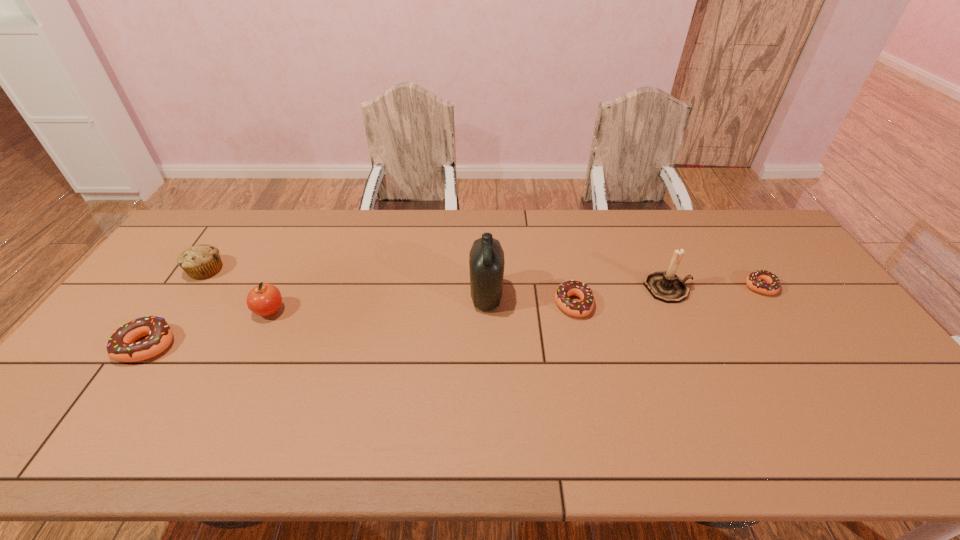
You are a GUI agent. You are given a task and a screenshot of the screen. Output one action in this format:
    pyautogui.click(x=<x>, y=<y>)
    Task: Click on the unoccupied position between the third tallest object and the candle holder
    
    Given the screenshot: What is the action you would take?
    pyautogui.click(x=468, y=300)

The height and width of the screenshot is (540, 960). I want to click on vacant space in between the bottle and the fifth shortest object, so click(x=378, y=304).

You are a GUI agent. You are given a task and a screenshot of the screen. Output one action in this format:
    pyautogui.click(x=<x>, y=<y>)
    Task: Click on the vacant space that is in between the fifth shortest object and the third shortest object
    The width and height of the screenshot is (960, 540).
    Given the screenshot: What is the action you would take?
    pyautogui.click(x=208, y=328)

Image resolution: width=960 pixels, height=540 pixels. Find the location of `unoccupied area between the shortest doughnut and the apple`. unoccupied area between the shortest doughnut and the apple is located at coordinates (516, 299).

Locate an element on the screen. The width and height of the screenshot is (960, 540). empty space that is in between the third object from left to right and the fifth tallest object is located at coordinates (208, 328).

At what (x,y) coordinates should I click in order to perform the action: click on vacant point located between the tallest object and the tallest doughnut. Please return your answer as a coordinate pair (x, y). The image size is (960, 540). Looking at the image, I should click on (317, 321).

Image resolution: width=960 pixels, height=540 pixels. I want to click on free space between the fifth object from left to right and the apple, so click(421, 308).

The height and width of the screenshot is (540, 960). In order to click on object that stands as the sixth closest to the fourth tallest object in this screenshot , I will do `click(764, 282)`.

I want to click on the fifth closest object relative to the fourth object from right to left, so click(202, 261).

Find the location of `the second closest doughnut relative to the shortest object`. the second closest doughnut relative to the shortest object is located at coordinates (121, 346).